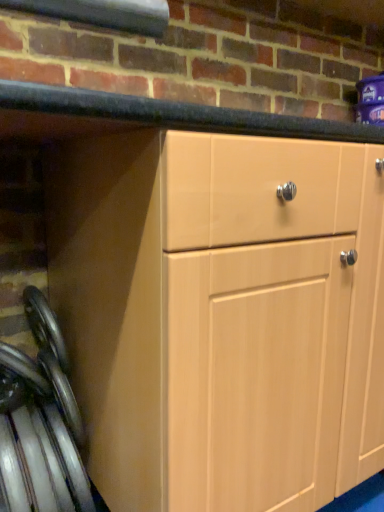
Describe the element at coordinates (40, 423) in the screenshot. I see `metallic silver hose at lower left` at that location.

Where is `metallic silver hose at lower left`? This screenshot has width=384, height=512. metallic silver hose at lower left is located at coordinates (40, 423).

Locate an element on the screen. metallic silver hose at lower left is located at coordinates (40, 423).